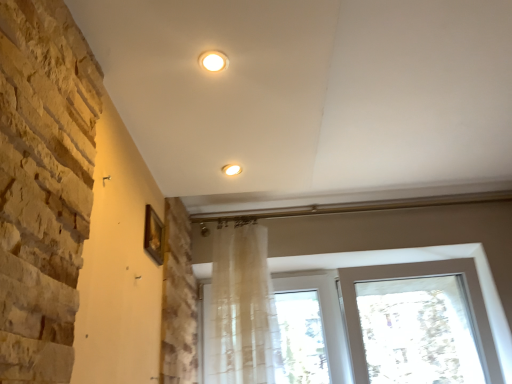
Question: Considering the relative positions of matte white light fixture at upper center, arranged as the second lighting when ordered from the bottom, and natural stone wall at left in the image provided, is matte white light fixture at upper center, arranged as the second lighting when ordered from the bottom, to the left of natural stone wall at left from the viewer's perspective?

Choices:
 (A) yes
 (B) no

Answer: (B)

Question: From the image's perspective, is matte white light fixture at upper center, the 2th lighting viewed from the back, located above natural stone wall at left?

Choices:
 (A) yes
 (B) no

Answer: (A)

Question: From the image's perspective, is matte white light fixture at upper center, the 2th lighting viewed from the back, beneath natural stone wall at left?

Choices:
 (A) yes
 (B) no

Answer: (B)

Question: Can you confirm if matte white light fixture at upper center, marked as the first lighting in a top-to-bottom arrangement, is smaller than natural stone wall at left?

Choices:
 (A) no
 (B) yes

Answer: (B)

Question: Is matte white light fixture at upper center, marked as the first lighting in a top-to-bottom arrangement, to the right of natural stone wall at left from the viewer's perspective?

Choices:
 (A) no
 (B) yes

Answer: (B)

Question: Is natural stone wall at left a part of matte white light fixture at upper center, which appears as the first lighting when viewed from the front?

Choices:
 (A) yes
 (B) no

Answer: (B)

Question: From a real-world perspective, is natural stone wall at left beneath translucent fabric shower curtain at center?

Choices:
 (A) yes
 (B) no

Answer: (B)

Question: Is natural stone wall at left oriented away from translucent fabric shower curtain at center?

Choices:
 (A) yes
 (B) no

Answer: (A)

Question: Could you tell me if natural stone wall at left is turned towards translucent fabric shower curtain at center?

Choices:
 (A) no
 (B) yes

Answer: (B)

Question: Can you confirm if natural stone wall at left is smaller than translucent fabric shower curtain at center?

Choices:
 (A) yes
 (B) no

Answer: (B)

Question: From the image's perspective, is natural stone wall at left below translucent fabric shower curtain at center?

Choices:
 (A) no
 (B) yes

Answer: (A)

Question: Is natural stone wall at left closer to the viewer compared to translucent fabric shower curtain at center?

Choices:
 (A) no
 (B) yes

Answer: (B)

Question: Is matte white light fixture at center, marked as the 2th lighting in a top-to-bottom arrangement, not inside matte white light fixture at upper center, arranged as the second lighting when ordered from the bottom?

Choices:
 (A) yes
 (B) no

Answer: (A)